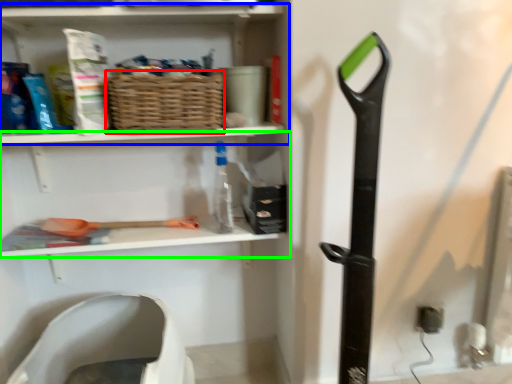
Question: Considering the real-world distances, which object is closest to basket (highlighted by a red box)? shelf (highlighted by a blue box) or shelf (highlighted by a green box).

Choices:
 (A) shelf
 (B) shelf

Answer: (A)